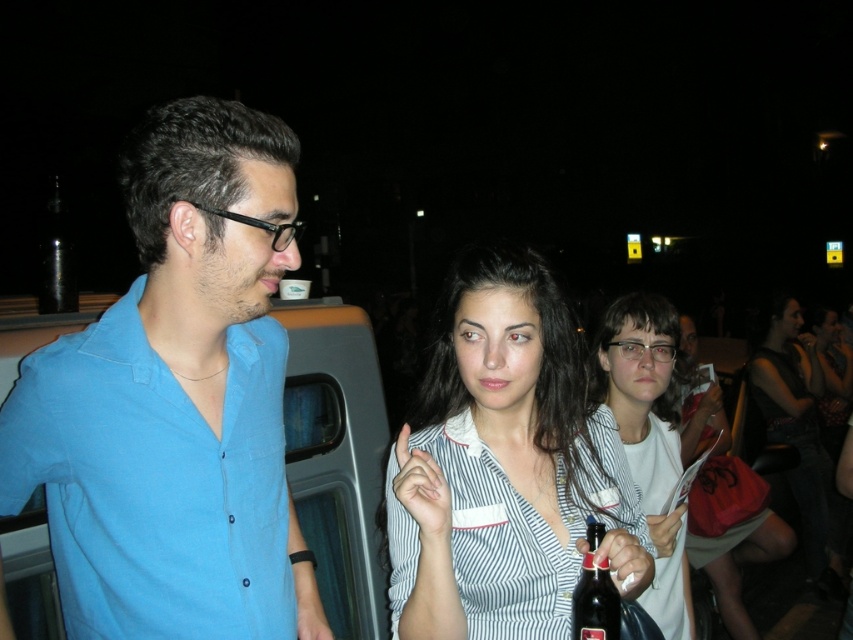
Question: Among these points, which one is farthest from the camera?

Choices:
 (A) (653, 477)
 (B) (53, 250)

Answer: (A)

Question: Is blue cotton shirt at left below white matte shirt at center?

Choices:
 (A) yes
 (B) no

Answer: (B)

Question: Does blue cotton shirt at left have a lesser width compared to striped fabric shirt at center?

Choices:
 (A) yes
 (B) no

Answer: (B)

Question: Among these objects, which one is nearest to the camera?

Choices:
 (A) striped fabric dress at center
 (B) blue cotton shirt at left
 (C) dark glass bottle at center
 (D) transparent glass bottle at upper left

Answer: (C)

Question: Can you confirm if blue cotton shirt at left is positioned below white striped shirt at center?

Choices:
 (A) no
 (B) yes

Answer: (A)

Question: Among these objects, which one is farthest from the camera?

Choices:
 (A) transparent glass bottle at upper left
 (B) dark glass bottle at center
 (C) white matte shirt at center

Answer: (A)